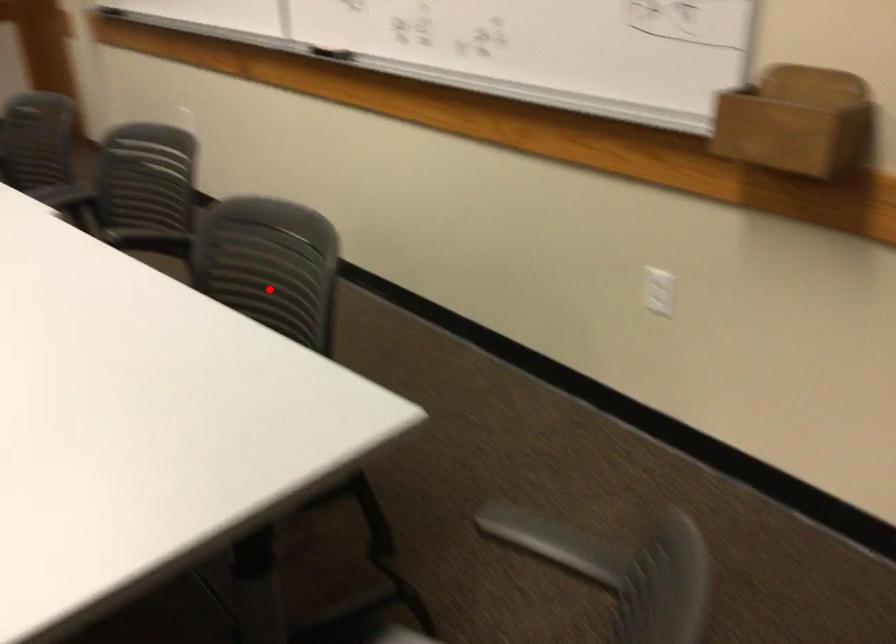
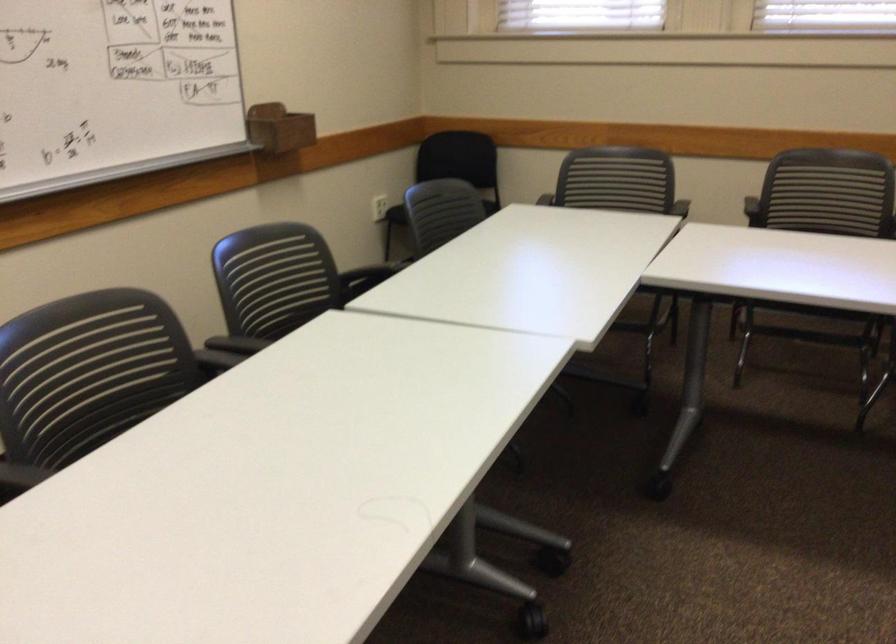
Question: I am providing you with two images of the same scene from different viewpoints. A red point is marked on the first image. Is the red point's position out of view in image 2?

Choices:
 (A) Yes
 (B) No

Answer: (A)